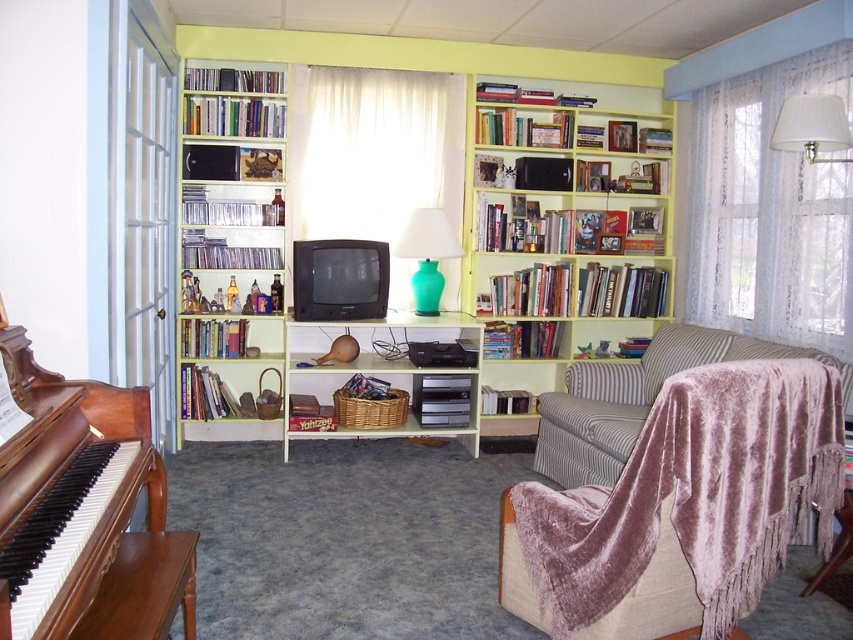
You are moving a large potted plant that is 36 inches wide into the living room. You want to place it between the wooden bookshelf at center and the wicker basket at center. Is there enough space for the plant to fit without overlapping either object?

The wooden bookshelf at center is 33.95 inches away from the wicker basket at center. Since the plant is 36 inches wide, it would not fit between them as the distance is less than the plant width.

You are standing in the living room and want to place a new painting on the wall directly above the wooden bookshelf at center. According to the scene description, where should you position the painting?

The wooden bookshelf at center is located at coordinates 0.338 on the x axis and 0.664 on the y axis, so you should position the painting directly above these coordinates.